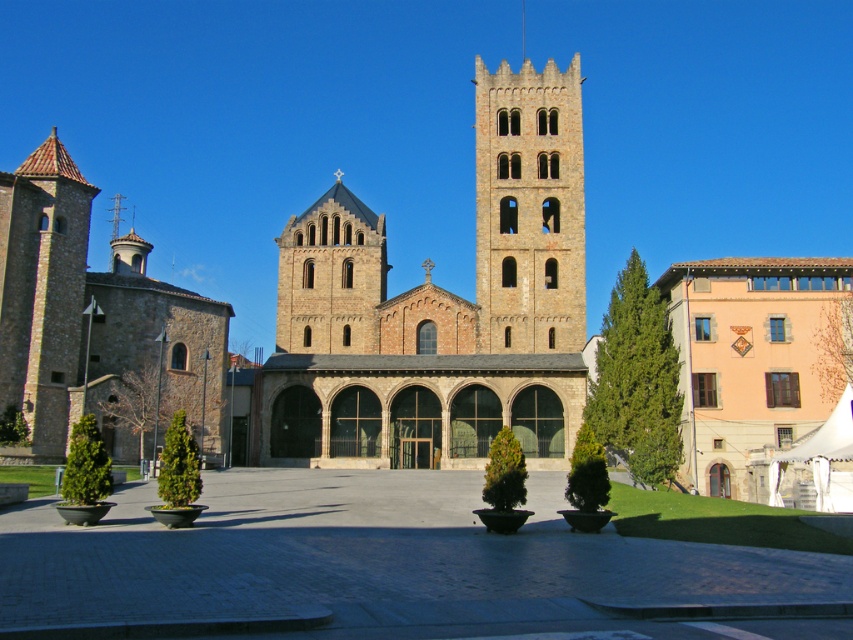
Where is `brown stone church at left`? The height and width of the screenshot is (640, 853). brown stone church at left is located at coordinates (96, 324).

Which is in front, point (225, 332) or point (321, 227)?

Point (225, 332) is in front.

Is point (213, 360) closer to camera compared to point (357, 232)?

Yes, it is in front of point (357, 232).

Find the location of `brown stone church at left`. brown stone church at left is located at coordinates (96, 324).

Is brown stone tower at left wider than smooth stone tower at center?

Yes.

Who is more distant from viewer, (70, 225) or (316, 308)?

Positioned behind is point (316, 308).

This screenshot has width=853, height=640. What are the coordinates of `brown stone tower at left` in the screenshot? It's located at (41, 292).

Identify the location of brown stone tower at left. Image resolution: width=853 pixels, height=640 pixels. (41, 292).

In the scene shown: Is brown stone church at center shorter than brown stone tower at left?

No, brown stone church at center is not shorter than brown stone tower at left.

Locate an element on the screen. Image resolution: width=853 pixels, height=640 pixels. brown stone church at center is located at coordinates (440, 308).

Find the location of a particular element. This screenshot has width=853, height=640. brown stone church at center is located at coordinates [440, 308].